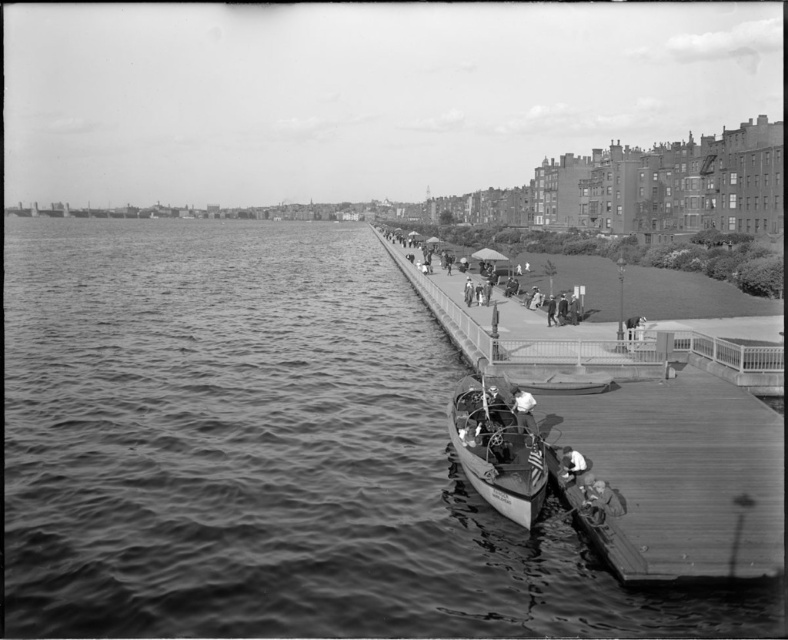
Question: Which point is closer to the camera?

Choices:
 (A) white fabric shirt at lower right
 (B) smooth water at center

Answer: (B)

Question: Can you confirm if smooth water at center is positioned above wooden boat at lower center?

Choices:
 (A) no
 (B) yes

Answer: (B)

Question: Which of these objects is positioned closest to the smooth water at center?

Choices:
 (A) smooth leather jacket at lower right
 (B) white fabric shirt at lower right
 (C) wooden dock at lower right

Answer: (C)

Question: Is white fabric shirt at lower right closer to camera compared to smooth skin person at center?

Choices:
 (A) yes
 (B) no

Answer: (A)

Question: Is smooth water at center behind smooth leather jacket at lower right?

Choices:
 (A) no
 (B) yes

Answer: (A)

Question: Which point is farther from the camera taking this photo?

Choices:
 (A) (565, 456)
 (B) (526, 525)
 (C) (526, 403)

Answer: (C)